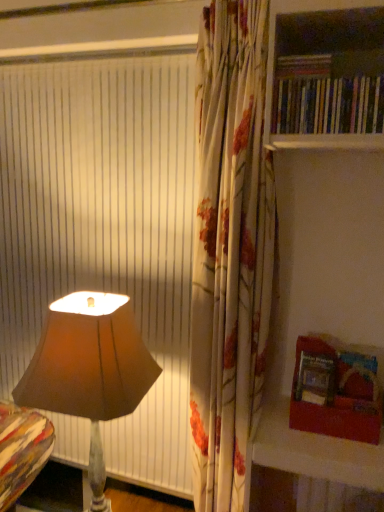
This screenshot has width=384, height=512. What do you see at coordinates (303, 66) in the screenshot? I see `hardcover book at upper right, acting as the second book starting from the bottom` at bounding box center [303, 66].

Image resolution: width=384 pixels, height=512 pixels. I want to click on wooden bookshelf at right, so click(326, 76).

Does hardcover book at upper right, which ranks as the first book in top-to-bottom order, have a greater width compared to brown fabric lamp at left?

No.

Could you measure the distance between hardcover book at upper right, acting as the second book starting from the bottom, and brown fabric lamp at left?

hardcover book at upper right, acting as the second book starting from the bottom, is 92.84 centimeters from brown fabric lamp at left.

Can brown fabric lamp at left be found inside hardcover book at upper right, which ranks as the first book in top-to-bottom order?

Actually, brown fabric lamp at left is outside hardcover book at upper right, which ranks as the first book in top-to-bottom order.

Is hardcover book at upper right, which ranks as the first book in top-to-bottom order, looking in the opposite direction of brown fabric lamp at left?

That's not correct — hardcover book at upper right, which ranks as the first book in top-to-bottom order, is not looking away from brown fabric lamp at left.

Which book is the 1st one when counting from the back of the wooden bookshelf at right? Please provide its 2D coordinates.

[(330, 105)]

Considering the relative positions of hardcover books at upper right, which ranks as the 1th book in bottom-to-top order, and wooden bookshelf at right in the image provided, is hardcover books at upper right, which ranks as the 1th book in bottom-to-top order, to the left of wooden bookshelf at right from the viewer's perspective?

In fact, hardcover books at upper right, which ranks as the 1th book in bottom-to-top order, is to the right of wooden bookshelf at right.

Is hardcover books at upper right, acting as the 2th book starting from the top, facing away from wooden bookshelf at right?

Yes, hardcover books at upper right, acting as the 2th book starting from the top, is positioned with its back facing wooden bookshelf at right.

Is wooden bookshelf at right surrounded by hardcover books at upper right, which ranks as the 1th book in bottom-to-top order?

That's incorrect, wooden bookshelf at right is not inside hardcover books at upper right, which ranks as the 1th book in bottom-to-top order.

Does point (383, 111) lie behind point (16, 395)?

No, it is not.

Is the position of hardcover books at upper right, acting as the 2th book starting from the top, less distant than that of brown fabric lamp at left?

Yes, it is.

Which of these two, hardcover books at upper right, which ranks as the 1th book in bottom-to-top order, or brown fabric lamp at left, is smaller?

With smaller size is hardcover books at upper right, which ranks as the 1th book in bottom-to-top order.

In terms of height, does hardcover books at upper right, which ranks as the 1th book in bottom-to-top order, look taller or shorter compared to brown fabric lamp at left?

Considering their sizes, hardcover books at upper right, which ranks as the 1th book in bottom-to-top order, has less height than brown fabric lamp at left.

Does hardcover book at upper right, acting as the second book starting from the bottom, have a larger size compared to wooden bookshelf at right?

Incorrect, hardcover book at upper right, acting as the second book starting from the bottom, is not larger than wooden bookshelf at right.

Is hardcover book at upper right, acting as the second book starting from the bottom, placed right next to wooden bookshelf at right?

hardcover book at upper right, acting as the second book starting from the bottom, and wooden bookshelf at right are clearly separated.

Can you confirm if hardcover book at upper right, which ranks as the first book in top-to-bottom order, is taller than wooden bookshelf at right?

Incorrect, the height of hardcover book at upper right, which ranks as the first book in top-to-bottom order, is not larger of that of wooden bookshelf at right.

Considering the sizes of objects brown fabric lamp at left and hardcover books at upper right, which ranks as the 1th book in bottom-to-top order, in the image provided, who is taller, brown fabric lamp at left or hardcover books at upper right, which ranks as the 1th book in bottom-to-top order,?

brown fabric lamp at left.

Based on the photo, which is more to the right, brown fabric lamp at left or hardcover books at upper right, acting as the 2th book starting from the top?

hardcover books at upper right, acting as the 2th book starting from the top, is more to the right.

Is point (85, 358) behind point (340, 112)?

Yes.

Is hardcover books at upper right, acting as the 2th book starting from the top, aimed at hardcover book at upper right, which ranks as the first book in top-to-bottom order?

No.

Considering the positions of points (362, 90) and (306, 75), is point (362, 90) farther from camera compared to point (306, 75)?

No.

Would you say hardcover books at upper right, acting as the 2th book starting from the top, is inside or outside hardcover book at upper right, acting as the second book starting from the bottom?

hardcover books at upper right, acting as the 2th book starting from the top, is not inside hardcover book at upper right, acting as the second book starting from the bottom, it's outside.

Does hardcover books at upper right, which ranks as the 1th book in bottom-to-top order, have a greater height compared to hardcover book at upper right, acting as the second book starting from the bottom?

Yes.

Is hardcover book at lower right to the left or to the right of wooden bookshelf at right in the image?

Based on their positions, hardcover book at lower right is located to the left of wooden bookshelf at right.

Which of these two, hardcover book at lower right or wooden bookshelf at right, is bigger?

Bigger between the two is wooden bookshelf at right.

Is hardcover book at lower right oriented towards wooden bookshelf at right?

No, hardcover book at lower right is not facing towards wooden bookshelf at right.

Where is `lamp below the hardcover book at upper right, acting as the second book starting from the bottom (from the image's perspective)`? This screenshot has height=512, width=384. lamp below the hardcover book at upper right, acting as the second book starting from the bottom (from the image's perspective) is located at coordinates (89, 369).

You are a GUI agent. You are given a task and a screenshot of the screen. Output one action in this format:
    pyautogui.click(x=<x>, y=<y>)
    Task: Click on the book on the right side of wooden bookshelf at right
    
    Given the screenshot: What is the action you would take?
    pyautogui.click(x=330, y=105)

Looking at the image, which one is located further to brown fabric lamp at left, hardcover book at lower right or wooden bookshelf at right?

wooden bookshelf at right lies further to brown fabric lamp at left than the other object.

Which object lies further to the anchor point hardcover book at upper right, which ranks as the first book in top-to-bottom order, hardcover book at lower right or brown fabric lamp at left?

brown fabric lamp at left lies further to hardcover book at upper right, which ranks as the first book in top-to-bottom order, than the other object.

From the image, which object appears to be farther from hardcover books at upper right, acting as the 2th book starting from the top, hardcover book at upper right, which ranks as the first book in top-to-bottom order, or brown fabric lamp at left?

brown fabric lamp at left is positioned further to the anchor hardcover books at upper right, acting as the 2th book starting from the top.

When comparing their distances from wooden bookshelf at right, does hardcover book at upper right, acting as the second book starting from the bottom, or brown fabric lamp at left seem further?

Based on the image, brown fabric lamp at left appears to be further to wooden bookshelf at right.

Which object lies further to the anchor point wooden bookshelf at right, hardcover book at lower right or hardcover books at upper right, which ranks as the 1th book in bottom-to-top order?

hardcover book at lower right is positioned further to the anchor wooden bookshelf at right.

Which object lies further to the anchor point wooden bookshelf at right, hardcover book at lower right or hardcover book at upper right, which ranks as the first book in top-to-bottom order?

hardcover book at lower right lies further to wooden bookshelf at right than the other object.

Which object lies further to the anchor point hardcover books at upper right, acting as the 2th book starting from the top, hardcover book at upper right, which ranks as the first book in top-to-bottom order, or wooden bookshelf at right?

wooden bookshelf at right.

Estimate the real-world distances between objects in this image. Which object is further from hardcover book at upper right, which ranks as the first book in top-to-bottom order, hardcover books at upper right, acting as the 2th book starting from the top, or hardcover book at lower right?

Based on the image, hardcover book at lower right appears to be further to hardcover book at upper right, which ranks as the first book in top-to-bottom order.

I want to click on paperback book between wooden bookshelf at right and brown fabric lamp at left in the vertical direction, so click(x=315, y=379).

At what (x,y) coordinates should I click in order to perform the action: click on book between hardcover book at upper right, which ranks as the first book in top-to-bottom order, and brown fabric lamp at left, in the vertical direction. Please return your answer as a coordinate pair (x, y). Image resolution: width=384 pixels, height=512 pixels. Looking at the image, I should click on (330, 105).

Where is `book positioned between wooden bookshelf at right and hardcover book at upper right, acting as the second book starting from the bottom, from near to far`? book positioned between wooden bookshelf at right and hardcover book at upper right, acting as the second book starting from the bottom, from near to far is located at coordinates (330, 105).

Image resolution: width=384 pixels, height=512 pixels. In order to click on book that lies between wooden bookshelf at right and hardcover book at lower right from top to bottom in this screenshot , I will do `click(330, 105)`.